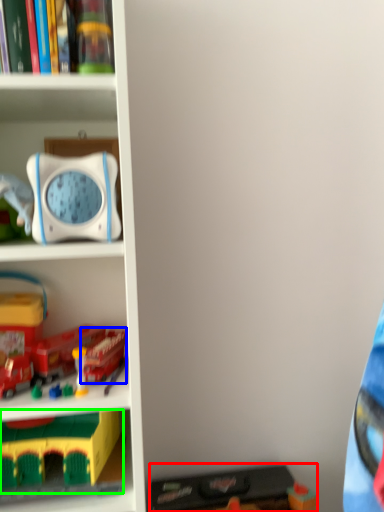
Question: Considering the real-world distances, which object is closest to toy (highlighted by a red box)? toy (highlighted by a blue box) or toy (highlighted by a green box).

Choices:
 (A) toy
 (B) toy

Answer: (B)